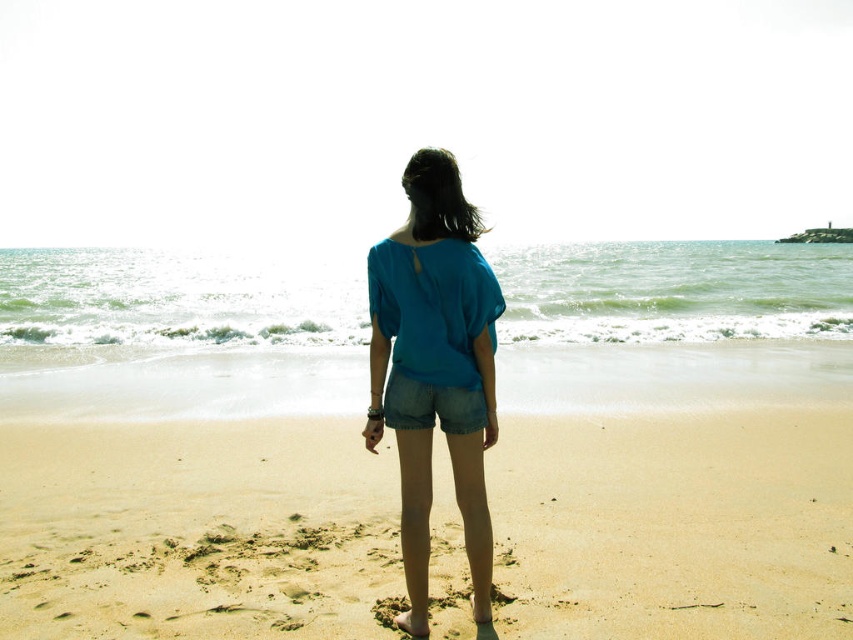
Question: Can you confirm if smooth sand beach at center is thinner than denim shorts at center?

Choices:
 (A) no
 (B) yes

Answer: (A)

Question: Which object is farther from the camera taking this photo?

Choices:
 (A) denim shorts at center
 (B) smooth sand beach at center
 (C) matte blue blouse at center

Answer: (B)

Question: Which object is farther from the camera taking this photo?

Choices:
 (A) denim shorts at center
 (B) smooth sand beach at center
 (C) matte blue blouse at center

Answer: (B)

Question: Where is smooth sand beach at center located in relation to denim shorts at center in the image?

Choices:
 (A) left
 (B) right

Answer: (B)

Question: Which point is farther to the camera?

Choices:
 (A) (44, 403)
 (B) (468, 397)
 (C) (428, 262)

Answer: (A)

Question: Can you confirm if smooth sand beach at center is wider than matte blue blouse at center?

Choices:
 (A) no
 (B) yes

Answer: (B)